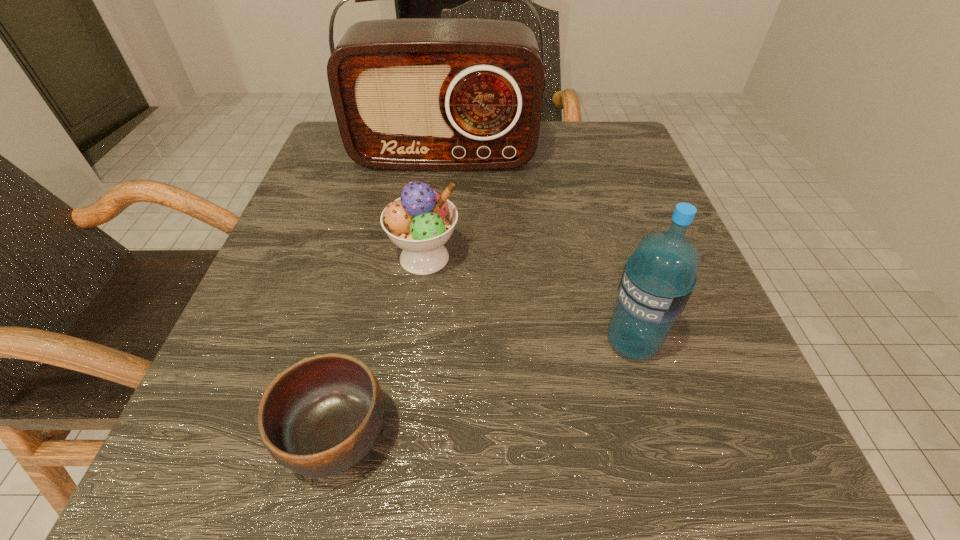
Where is `the farthest object`? The width and height of the screenshot is (960, 540). the farthest object is located at coordinates (420, 94).

This screenshot has height=540, width=960. In order to click on the tallest object in this screenshot , I will do `click(420, 94)`.

Identify the location of water bottle. (658, 279).

Identify the location of the third shortest object. The height and width of the screenshot is (540, 960). (658, 279).

At what (x,y) coordinates should I click in order to perform the action: click on icecream. Please return your answer as a coordinate pair (x, y). Looking at the image, I should click on (420, 222).

Where is `the third nearest object`? the third nearest object is located at coordinates (420, 222).

Identify the location of the nearest object. (321, 416).

Find the location of a particular element. This screenshot has height=540, width=960. the shortest object is located at coordinates (321, 416).

Find the location of a particular element. vacant space located on the front panel of the farthest object is located at coordinates (437, 224).

What are the coordinates of `vacant space located 0.140m on the back of the third shortest object` in the screenshot? It's located at (606, 253).